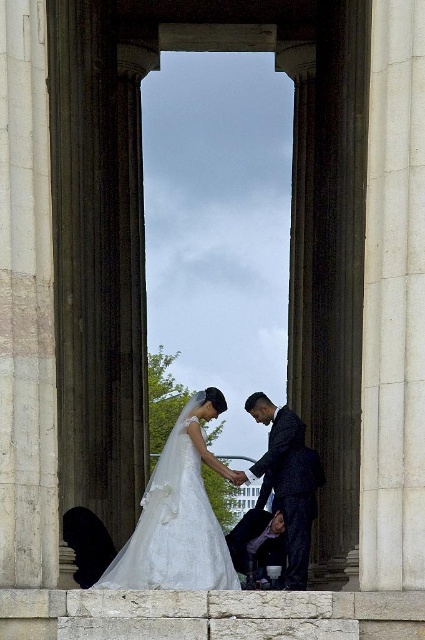
Question: Is white satin dress at center behind dark blue suit at center?

Choices:
 (A) no
 (B) yes

Answer: (A)

Question: Which is farther from the dark blue suit at center?

Choices:
 (A) dark blue textured suit at center
 (B) white satin dress at center

Answer: (B)

Question: From the image, what is the correct spatial relationship of white satin dress at center in relation to dark blue suit at center?

Choices:
 (A) below
 (B) above

Answer: (B)

Question: Which object appears farthest from the camera in this image?

Choices:
 (A) dark blue textured suit at center
 (B) dark blue suit at center

Answer: (B)

Question: Which object appears farthest from the camera in this image?

Choices:
 (A) dark blue textured suit at center
 (B) dark blue suit at center

Answer: (B)

Question: Is the position of white satin dress at center more distant than that of dark blue suit at center?

Choices:
 (A) no
 (B) yes

Answer: (A)